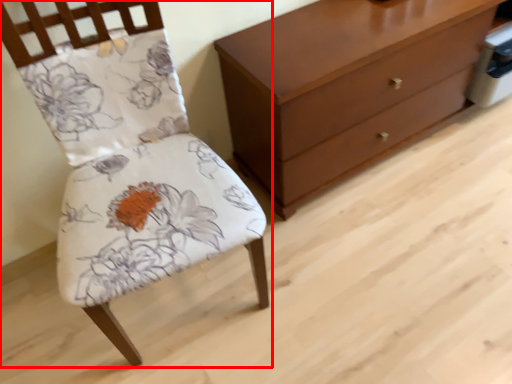
Question: From the image's perspective, what is the correct spatial positioning of chair (annotated by the red box) in reference to chest of drawers?

Choices:
 (A) below
 (B) above

Answer: (A)